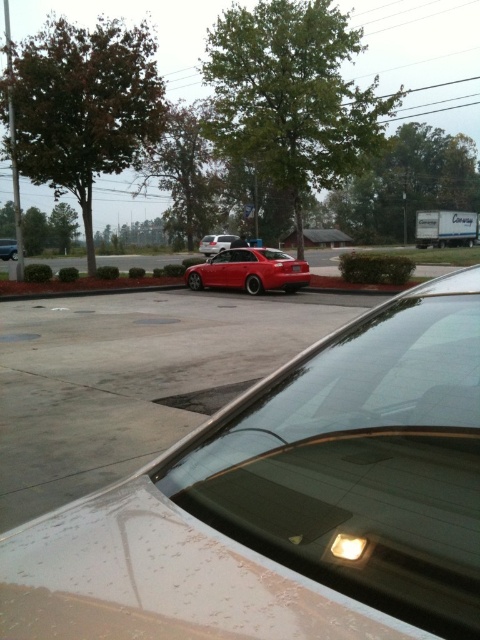
Question: Does shiny red sedan at center have a greater width compared to smooth concrete curb at center?

Choices:
 (A) yes
 (B) no

Answer: (A)

Question: Among these objects, which one is farthest from the camera?

Choices:
 (A) glossy red car at center
 (B) shiny red car at center
 (C) shiny red sedan at center

Answer: (A)

Question: Which object is closer to the camera taking this photo?

Choices:
 (A) glossy red car at center
 (B) satin silver sedan at center
 (C) smooth concrete curb at center
 (D) shiny red sedan at center

Answer: (D)

Question: Considering the real-world distances, which object is farthest from the glossy red car at center?

Choices:
 (A) satin silver sedan at center
 (B) shiny red car at center
 (C) shiny red sedan at center

Answer: (B)

Question: Is shiny red car at center bigger than shiny red sedan at center?

Choices:
 (A) no
 (B) yes

Answer: (A)

Question: Is shiny red car at center bigger than glossy red car at center?

Choices:
 (A) yes
 (B) no

Answer: (B)